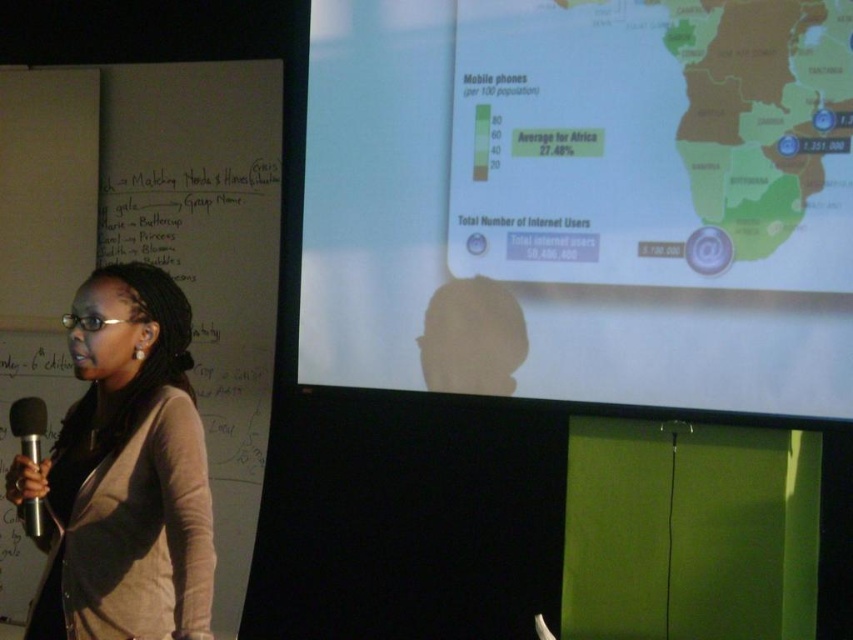
Question: Which of the following is the closest to the observer?

Choices:
 (A) (167, 369)
 (B) (39, 522)

Answer: (B)

Question: Is white matte projection screen at upper center above silver metallic microphone at lower left?

Choices:
 (A) no
 (B) yes

Answer: (B)

Question: Considering the real-world distances, which object is farthest from the white matte projection screen at upper center?

Choices:
 (A) matte black jacket at left
 (B) silver metallic microphone at lower left

Answer: (B)

Question: Does white matte projection screen at upper center have a larger size compared to matte black jacket at left?

Choices:
 (A) no
 (B) yes

Answer: (B)

Question: Considering the real-world distances, which object is farthest from the white matte projection screen at upper center?

Choices:
 (A) silver metallic microphone at lower left
 (B) matte black jacket at left

Answer: (A)

Question: Is the position of white matte projection screen at upper center more distant than that of silver metallic microphone at lower left?

Choices:
 (A) no
 (B) yes

Answer: (B)